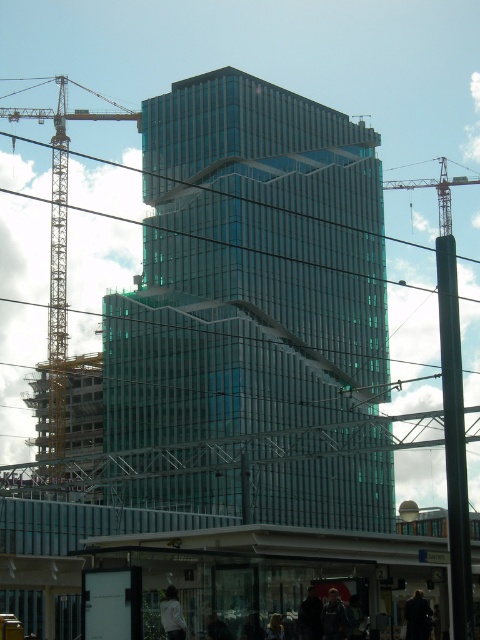
You are standing at the bus stop shelter with a transparent roof supported by metal beams. You see the metallic yellow crane at left and the dark blue fabric jacket at center. How far apart are these two objects?

The metallic yellow crane at left and the dark blue fabric jacket at center are 553.49 feet apart.

You are a city planner observing the scene. The metallic yellow crane at left and the dark blue jacket at lower center are both in your view. Which object is taller?

The metallic yellow crane at left is much taller than the dark blue jacket at lower center.

You are standing at the bus stop shelter with the transparent roof. You see a metallic yellow crane at left and a dark blue jacket at lower center. Which object is higher in the scene?

The metallic yellow crane at left is located above the dark blue jacket at lower center, so it is higher in the scene.